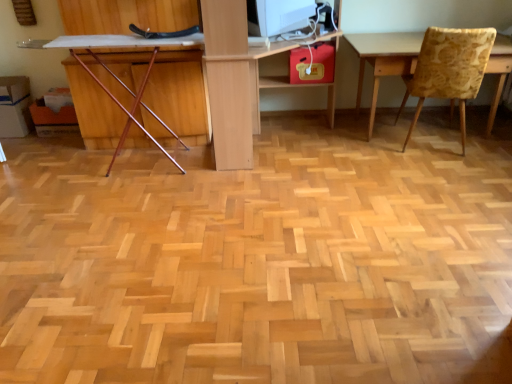
Question: Is wooden chair at left, placed as the 2th chair when sorted from right to left, touching white glossy computer monitor at upper center?

Choices:
 (A) no
 (B) yes

Answer: (A)

Question: Can you confirm if wooden chair at left, placed as the 2th chair when sorted from right to left, is smaller than white glossy computer monitor at upper center?

Choices:
 (A) no
 (B) yes

Answer: (A)

Question: From a real-world perspective, is wooden chair at left, placed as the 2th chair when sorted from right to left, over white glossy computer monitor at upper center?

Choices:
 (A) yes
 (B) no

Answer: (B)

Question: Is white glossy computer monitor at upper center at the back of wooden chair at left, placed as the 2th chair when sorted from right to left?

Choices:
 (A) no
 (B) yes

Answer: (A)

Question: Is wooden chair at left, which appears as the first chair when viewed from the left, to the right of white glossy computer monitor at upper center from the viewer's perspective?

Choices:
 (A) yes
 (B) no

Answer: (B)

Question: Looking at the image, does wooden chair at left, which appears as the first chair when viewed from the left, seem bigger or smaller compared to light wood computer desk at center?

Choices:
 (A) small
 (B) big

Answer: (A)

Question: Does point (150, 71) appear closer or farther from the camera than point (210, 107)?

Choices:
 (A) farther
 (B) closer

Answer: (A)

Question: Visually, is wooden chair at left, placed as the 2th chair when sorted from right to left, positioned to the left or to the right of light wood computer desk at center?

Choices:
 (A) right
 (B) left

Answer: (B)

Question: From a real-world perspective, is wooden chair at left, placed as the 2th chair when sorted from right to left, positioned above or below light wood computer desk at center?

Choices:
 (A) above
 (B) below

Answer: (B)

Question: Considering the positions of yellow floral fabric chair at right, placed as the second chair when sorted from left to right, and white glossy computer monitor at upper center in the image, is yellow floral fabric chair at right, placed as the second chair when sorted from left to right, taller or shorter than white glossy computer monitor at upper center?

Choices:
 (A) tall
 (B) short

Answer: (A)

Question: Is point (423, 72) positioned closer to the camera than point (252, 8)?

Choices:
 (A) farther
 (B) closer

Answer: (A)

Question: From a real-world perspective, is yellow floral fabric chair at right, the 1th chair positioned from the right, physically located above or below white glossy computer monitor at upper center?

Choices:
 (A) above
 (B) below

Answer: (B)

Question: Is yellow floral fabric chair at right, the 1th chair positioned from the right, inside the boundaries of white glossy computer monitor at upper center, or outside?

Choices:
 (A) outside
 (B) inside

Answer: (A)

Question: Considering the relative positions of light wood computer desk at center and yellow floral fabric chair at right, placed as the second chair when sorted from left to right, in the image provided, is light wood computer desk at center to the left or to the right of yellow floral fabric chair at right, placed as the second chair when sorted from left to right,?

Choices:
 (A) right
 (B) left

Answer: (B)

Question: Considering the positions of light wood computer desk at center and yellow floral fabric chair at right, placed as the second chair when sorted from left to right, in the image, is light wood computer desk at center wider or thinner than yellow floral fabric chair at right, placed as the second chair when sorted from left to right,?

Choices:
 (A) wide
 (B) thin

Answer: (A)